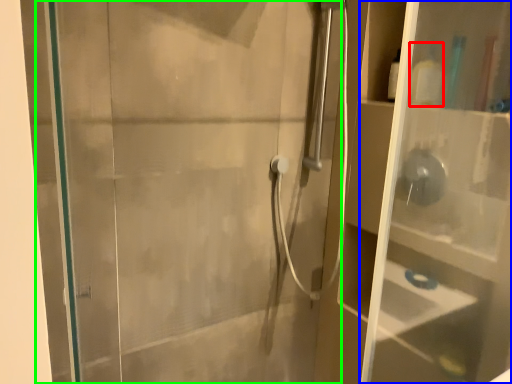
Question: Which object is positioned closest to toiletry (highlighted by a red box)? Select from glass box (highlighted by a blue box) and screen door (highlighted by a green box).

Choices:
 (A) glass box
 (B) screen door

Answer: (A)